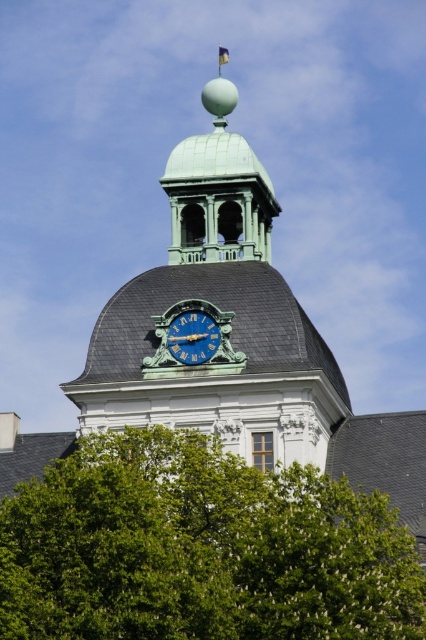
Does green metallic dome at center come behind green polished dome at center?

That is False.

Find the location of a particular element. Image resolution: width=426 pixels, height=640 pixels. green metallic dome at center is located at coordinates (219, 308).

Is green leafy tree at lower center closer to the viewer compared to green polished dome at center?

Yes, green leafy tree at lower center is in front of green polished dome at center.

Is point (141, 454) farther from viewer compared to point (170, 208)?

No.

Is point (204, 566) closer to viewer compared to point (227, 168)?

That is True.

Identify the location of green leafy tree at lower center. (201, 548).

Is green leafy tree at lower center to the left of green metallic dome at center from the viewer's perspective?

No, green leafy tree at lower center is not to the left of green metallic dome at center.

Between green leafy tree at lower center and green metallic dome at center, which one has more height?

green metallic dome at center

Is point (334, 563) closer to viewer compared to point (103, 324)?

That is True.

Where is `green leafy tree at lower center`? This screenshot has height=640, width=426. green leafy tree at lower center is located at coordinates (201, 548).